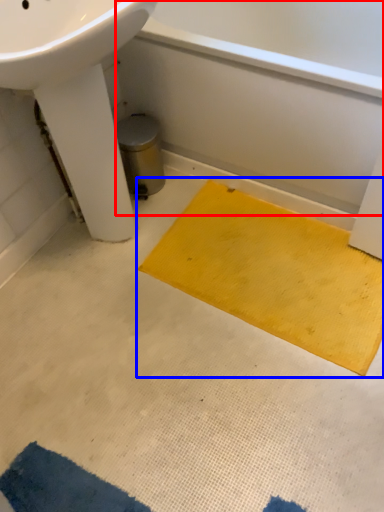
Question: Which of the following is the closest to the observer, bath (highlighted by a red box) or doormat (highlighted by a blue box)?

Choices:
 (A) bath
 (B) doormat

Answer: (A)